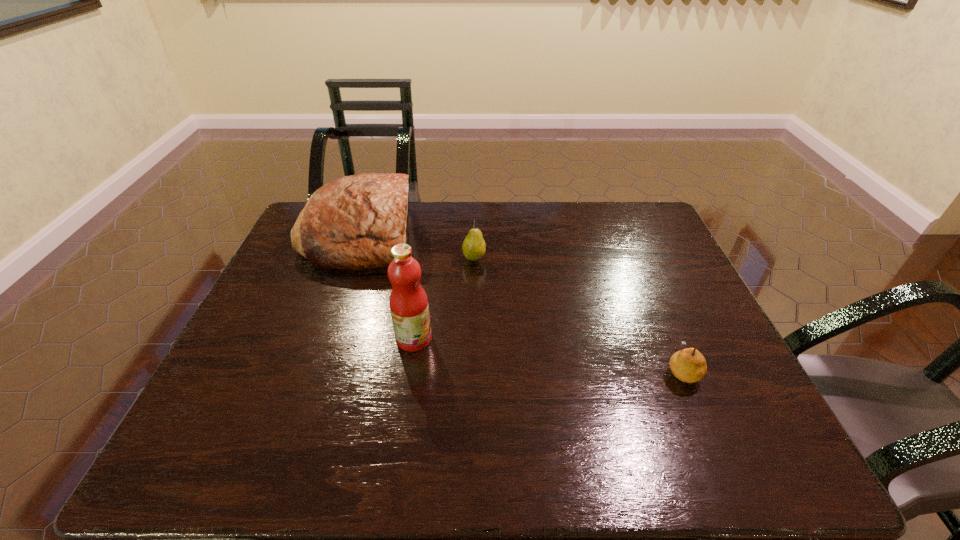
At what (x,y) coordinates should I click in order to perform the action: click on blank space that satisfies the following two spatial constraints: 1. at the sliced front of the third shortest object; 2. on the left side of the right pear. Please return your answer as a coordinate pair (x, y). The height and width of the screenshot is (540, 960). Looking at the image, I should click on (313, 370).

Find the location of `vacant area that satisfies the following two spatial constraints: 1. at the sliced front of the nearer pear; 2. on the right side of the second tallest object`. vacant area that satisfies the following two spatial constraints: 1. at the sliced front of the nearer pear; 2. on the right side of the second tallest object is located at coordinates (313, 370).